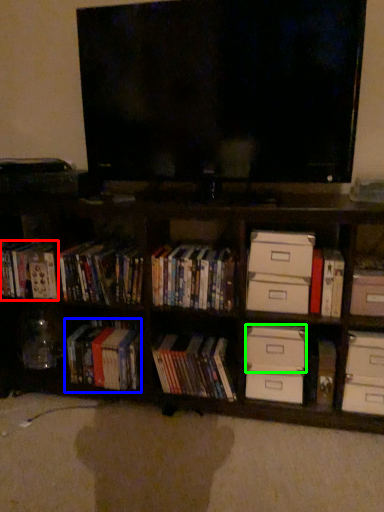
Question: Considering the real-world distances, which object is closest to book (highlighted by a red box)? book (highlighted by a blue box) or drawer (highlighted by a green box).

Choices:
 (A) book
 (B) drawer

Answer: (A)